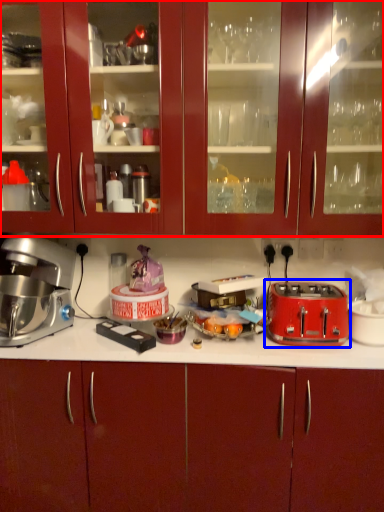
Question: Among these objects, which one is farthest to the camera, cabinetry (highlighted by a red box) or toaster (highlighted by a blue box)?

Choices:
 (A) cabinetry
 (B) toaster

Answer: (B)